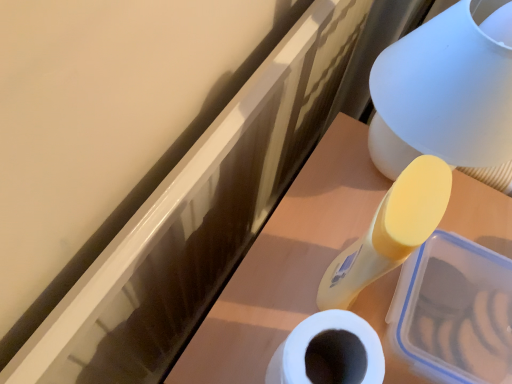
Question: Is matte white table lamp at upper right not close to white matte toilet paper at lower center?

Choices:
 (A) no
 (B) yes

Answer: (A)

Question: From the image's perspective, is matte white table lamp at upper right located beneath white matte toilet paper at lower center?

Choices:
 (A) yes
 (B) no

Answer: (B)

Question: Considering the relative positions of matte white table lamp at upper right and white matte toilet paper at lower center in the image provided, is matte white table lamp at upper right to the right of white matte toilet paper at lower center from the viewer's perspective?

Choices:
 (A) no
 (B) yes

Answer: (B)

Question: Can you confirm if matte white table lamp at upper right is wider than white matte toilet paper at lower center?

Choices:
 (A) no
 (B) yes

Answer: (B)

Question: Does matte white table lamp at upper right have a greater height compared to white matte toilet paper at lower center?

Choices:
 (A) yes
 (B) no

Answer: (A)

Question: Considering the relative sizes of matte white table lamp at upper right and white matte toilet paper at lower center in the image provided, is matte white table lamp at upper right bigger than white matte toilet paper at lower center?

Choices:
 (A) no
 (B) yes

Answer: (B)

Question: Does translucent plastic container at upper right have a larger size compared to white matte toilet paper at lower center?

Choices:
 (A) no
 (B) yes

Answer: (B)

Question: Considering the relative sizes of translucent plastic container at upper right and white matte toilet paper at lower center in the image provided, is translucent plastic container at upper right taller than white matte toilet paper at lower center?

Choices:
 (A) no
 (B) yes

Answer: (B)

Question: Is translucent plastic container at upper right far from white matte toilet paper at lower center?

Choices:
 (A) yes
 (B) no

Answer: (B)

Question: Considering the relative sizes of translucent plastic container at upper right and white matte toilet paper at lower center in the image provided, is translucent plastic container at upper right thinner than white matte toilet paper at lower center?

Choices:
 (A) no
 (B) yes

Answer: (A)

Question: Is translucent plastic container at upper right shorter than white matte toilet paper at lower center?

Choices:
 (A) yes
 (B) no

Answer: (B)

Question: Considering the relative positions of translucent plastic container at upper right and white matte toilet paper at lower center in the image provided, is translucent plastic container at upper right to the left of white matte toilet paper at lower center from the viewer's perspective?

Choices:
 (A) yes
 (B) no

Answer: (B)

Question: Could you tell me if translucent plastic container at upper right is turned towards matte white table lamp at upper right?

Choices:
 (A) no
 (B) yes

Answer: (A)